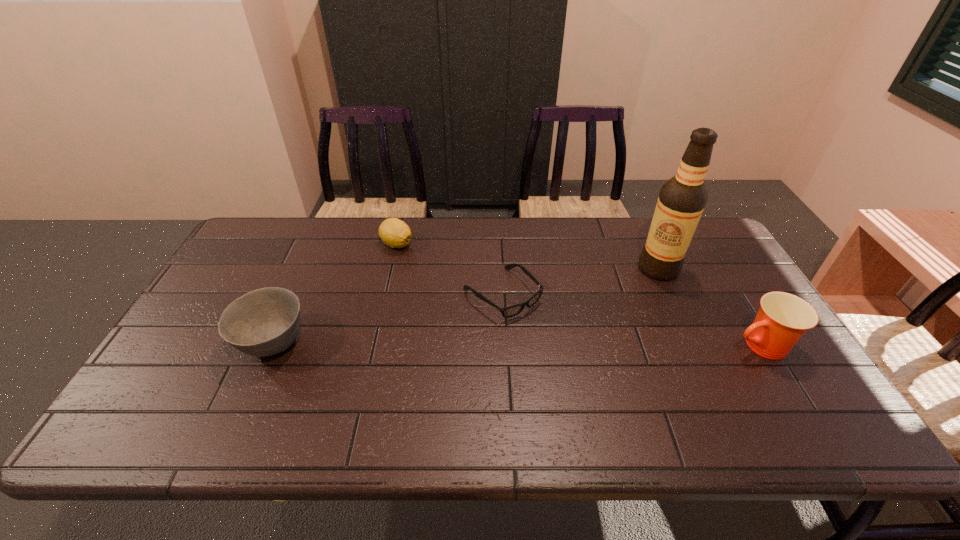
This screenshot has width=960, height=540. What are the coordinates of `the leftmost object` in the screenshot? It's located at (264, 322).

Image resolution: width=960 pixels, height=540 pixels. Identify the location of the third tallest object. (264, 322).

Locate an element on the screen. the second tallest object is located at coordinates (783, 318).

This screenshot has height=540, width=960. I want to click on the rightmost object, so click(783, 318).

Locate an element on the screen. alcohol is located at coordinates (682, 199).

Find the location of a particular element. This screenshot has width=960, height=540. the fourth object from left to right is located at coordinates (682, 199).

You are a GUI agent. You are given a task and a screenshot of the screen. Output one action in this format:
    pyautogui.click(x=<x>, y=<y>)
    Task: Click on the third object from right to left
    Image resolution: width=960 pixels, height=540 pixels.
    Given the screenshot: What is the action you would take?
    pyautogui.click(x=511, y=311)

Locate an element on the screen. spectacles is located at coordinates (511, 311).

Image resolution: width=960 pixels, height=540 pixels. I want to click on the second shortest object, so click(x=395, y=233).

Image resolution: width=960 pixels, height=540 pixels. Find the location of `lemon`. lemon is located at coordinates (395, 233).